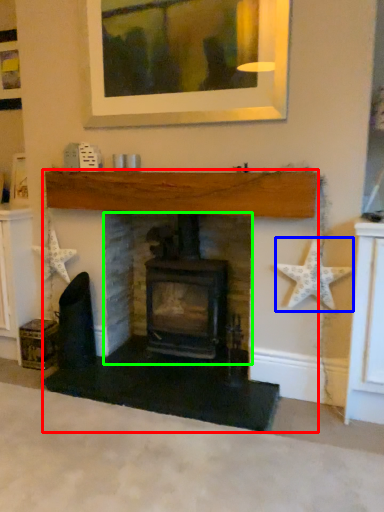
Question: Considering the real-world distances, which object is farthest from fireplace (highlighted by a red box)? starfish (highlighted by a blue box) or fireplace (highlighted by a green box)?

Choices:
 (A) starfish
 (B) fireplace

Answer: (A)